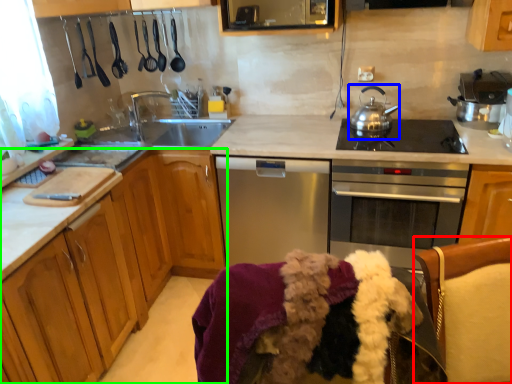
Question: Based on their relative distances, which object is nearer to swivel chair (highlighted by a red box)? Choose from tea pot (highlighted by a blue box) and cabinetry (highlighted by a green box).

Choices:
 (A) tea pot
 (B) cabinetry

Answer: (A)